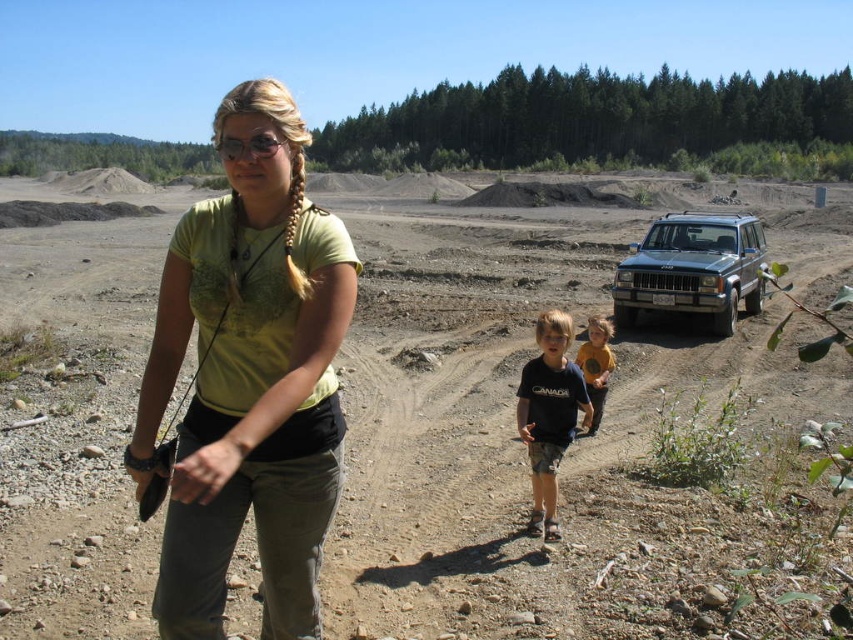
Question: Which object is the farthest from the matte yellow shirt at center?

Choices:
 (A) dirt field at center
 (B) yellow cotton shirt at center
 (C) dark blue t-shirt at center

Answer: (A)

Question: Which of the following is the closest to the observer?

Choices:
 (A) silver metallic suv at center right
 (B) dark blue t-shirt at center
 (C) dirt field at center
 (D) matte yellow shirt at center

Answer: (D)

Question: Among these objects, which one is nearest to the camera?

Choices:
 (A) yellow cotton shirt at center
 (B) matte yellow shirt at center
 (C) dark blue t-shirt at center
 (D) silver metallic suv at center right

Answer: (B)

Question: Can you confirm if matte yellow shirt at center is positioned above silver metallic suv at center right?

Choices:
 (A) no
 (B) yes

Answer: (A)

Question: Does dirt field at center have a lesser width compared to dark blue t-shirt at center?

Choices:
 (A) yes
 (B) no

Answer: (B)

Question: Where is silver metallic suv at center right located in relation to yellow cotton shirt at center in the image?

Choices:
 (A) left
 (B) right

Answer: (B)